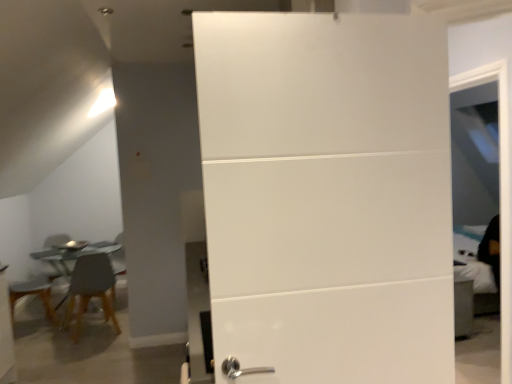
The image size is (512, 384). I want to click on matte brown wooden chair at left, so click(x=91, y=289).

Describe the element at coordinates (91, 289) in the screenshot. I see `matte brown wooden chair at left` at that location.

Find the location of a particular element. metallic glass table at left is located at coordinates (72, 256).

What's the angular difference between matte brown wooden chair at left and white glossy door at center's facing directions?

They differ by 164 degrees in their facing directions.

Between matte brown wooden chair at left and white glossy door at center, which one has smaller width?

white glossy door at center.

Does matte brown wooden chair at left appear on the right side of white glossy door at center?

In fact, matte brown wooden chair at left is to the left of white glossy door at center.

Which is in front, point (100, 295) or point (260, 128)?

The point (260, 128) is in front.

Is white glossy door at center facing away from matte brown wooden chair at left?

Yes, white glossy door at center is facing away from matte brown wooden chair at left.

Does point (446, 373) come farther from viewer compared to point (101, 279)?

No, (446, 373) is in front of (101, 279).

Are white glossy door at center and matte brown wooden chair at left making contact?

No, white glossy door at center is not beside matte brown wooden chair at left.

From the image's perspective, which one is positioned higher, white glossy door at center or matte brown wooden chair at left?

white glossy door at center.

Considering the positions of point (31, 255) and point (98, 256), is point (31, 255) closer or farther from the camera than point (98, 256)?

Point (31, 255) appears to be farther away from the viewer than point (98, 256).

Is there a large distance between metallic glass table at left and matte brown wooden chair at left?

No.

Who is bigger, metallic glass table at left or matte brown wooden chair at left?

With larger size is metallic glass table at left.

Is metallic glass table at left completely or partially inside white glossy door at center?

No, white glossy door at center does not contain metallic glass table at left.

Is white glossy door at center with metallic glass table at left?

white glossy door at center is not next to metallic glass table at left, and they're not touching.

Looking at this image, which of these two, white glossy door at center or metallic glass table at left, stands shorter?

With less height is metallic glass table at left.

Is metallic glass table at left turned away from white glossy door at center?

No, metallic glass table at left is not facing away from white glossy door at center.

From the image's perspective, between metallic glass table at left and white glossy door at center, who is located below?

metallic glass table at left appears lower in the image.

Between metallic glass table at left and white glossy door at center, which one has more height?

With more height is white glossy door at center.

Based on the photo, between metallic glass table at left and white glossy door at center, which one has larger size?

metallic glass table at left.

Is matte brown wooden chair at left oriented away from metallic glass table at left?

No, metallic glass table at left is not at the back of matte brown wooden chair at left.

Considering the relative sizes of matte brown wooden chair at left and metallic glass table at left in the image provided, is matte brown wooden chair at left taller than metallic glass table at left?

Yes.

From a real-world perspective, is matte brown wooden chair at left positioned over metallic glass table at left based on gravity?

Indeed, from a real-world perspective, matte brown wooden chair at left stands above metallic glass table at left.

Where is `table located behind the matte brown wooden chair at left`? table located behind the matte brown wooden chair at left is located at coordinates (72, 256).

Where is `door positioned vertically above the matte brown wooden chair at left (from a real-world perspective)`? Image resolution: width=512 pixels, height=384 pixels. door positioned vertically above the matte brown wooden chair at left (from a real-world perspective) is located at coordinates (327, 195).

In the image, there is a matte brown wooden chair at left. At what (x,y) coordinates should I click in order to perform the action: click on door above it (from the image's perspective). Please return your answer as a coordinate pair (x, y). Looking at the image, I should click on (327, 195).

Looking at the image, which one is located further to matte brown wooden chair at left, white glossy door at center or metallic glass table at left?

white glossy door at center lies further to matte brown wooden chair at left than the other object.

When comparing their distances from metallic glass table at left, does matte brown wooden chair at left or white glossy door at center seem closer?

matte brown wooden chair at left is closer to metallic glass table at left.

From the image, which object appears to be farther from metallic glass table at left, white glossy door at center or matte brown wooden chair at left?

Based on the image, white glossy door at center appears to be further to metallic glass table at left.

Consider the image. Looking at the image, which one is located closer to white glossy door at center, matte brown wooden chair at left or metallic glass table at left?

The object closer to white glossy door at center is matte brown wooden chair at left.

Considering their positions, is metallic glass table at left positioned closer to matte brown wooden chair at left than white glossy door at center?

Among the two, metallic glass table at left is located nearer to matte brown wooden chair at left.

When comparing their distances from white glossy door at center, does metallic glass table at left or matte brown wooden chair at left seem further?

metallic glass table at left lies further to white glossy door at center than the other object.

Locate an element on the screen. The height and width of the screenshot is (384, 512). chair between white glossy door at center and metallic glass table at left in the front-back direction is located at coordinates (91, 289).